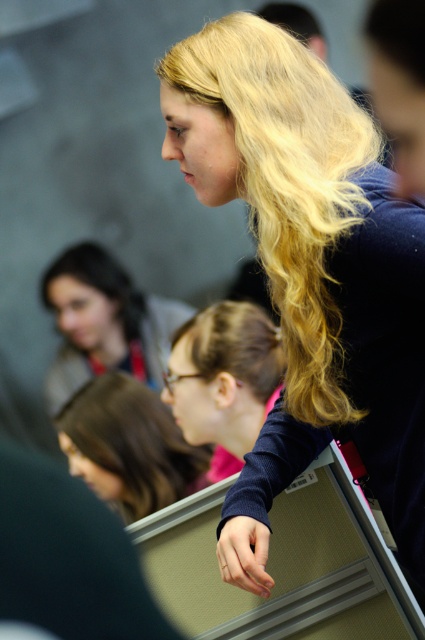
The width and height of the screenshot is (425, 640). I want to click on brown smooth hair at center, so click(x=129, y=445).

Can you confirm if brown smooth hair at center is positioned to the right of blonde silky hair at center?

In fact, brown smooth hair at center is to the left of blonde silky hair at center.

Where is `brown smooth hair at center`? This screenshot has height=640, width=425. brown smooth hair at center is located at coordinates (129, 445).

How distant is blonde silky hair at upper center from brown smooth hair at center?

blonde silky hair at upper center and brown smooth hair at center are 4.08 feet apart from each other.

Can you confirm if blonde silky hair at upper center is positioned above brown smooth hair at center?

Indeed, blonde silky hair at upper center is positioned over brown smooth hair at center.

Is point (283, 266) positioned in front of point (139, 481)?

Yes, point (283, 266) is closer to viewer.

You are a GUI agent. You are given a task and a screenshot of the screen. Output one action in this format:
    pyautogui.click(x=<x>, y=<y>)
    Task: Click on the blonde silky hair at upper center
    This screenshot has height=640, width=425.
    Given the screenshot: What is the action you would take?
    pyautogui.click(x=282, y=180)

Which is above, brown smooth hair at center or blonde hair at lower left?

blonde hair at lower left is above.

Is brown smooth hair at center to the right of blonde hair at lower left from the viewer's perspective?

Indeed, brown smooth hair at center is positioned on the right side of blonde hair at lower left.

The width and height of the screenshot is (425, 640). I want to click on brown smooth hair at center, so click(129, 445).

This screenshot has width=425, height=640. I want to click on brown smooth hair at center, so click(129, 445).